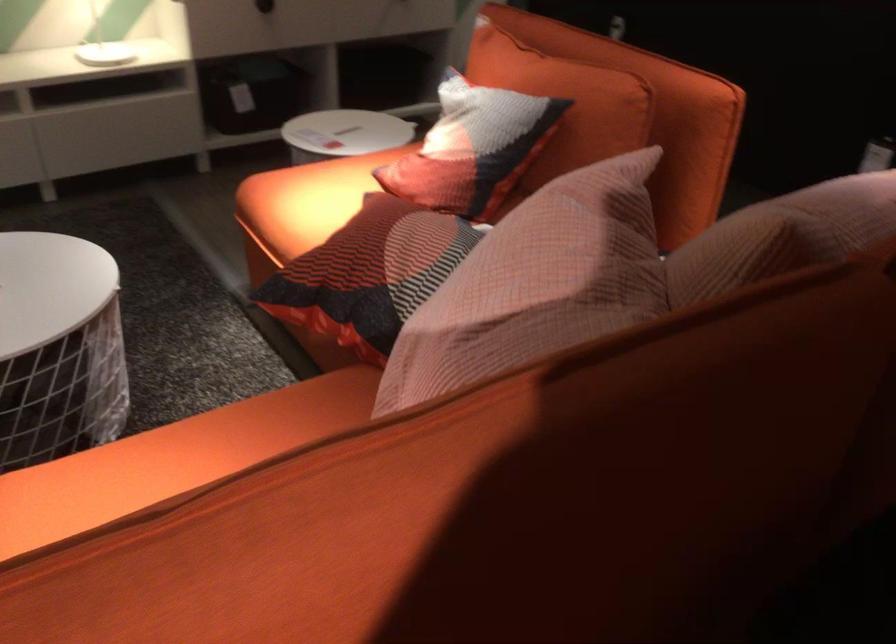
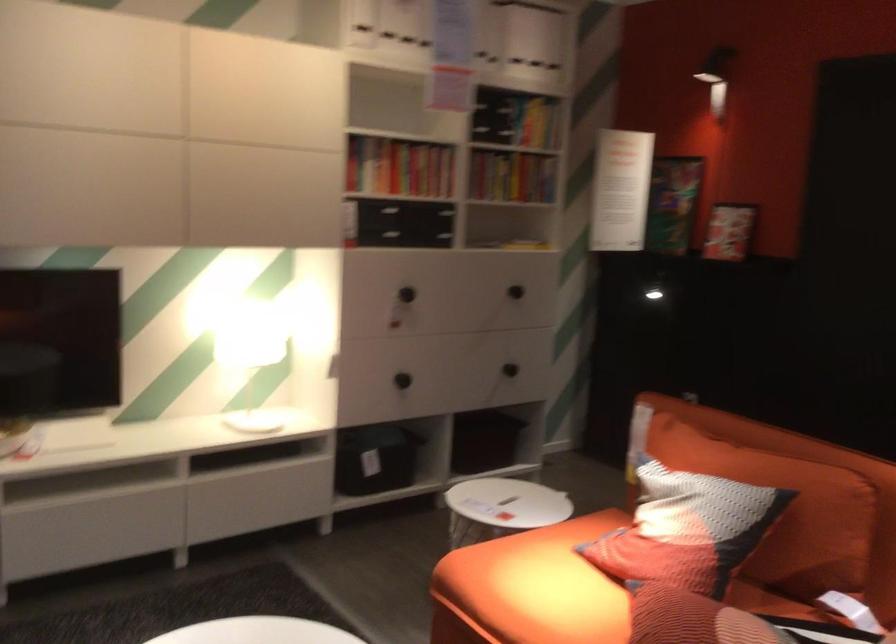
In the second image, find the point that corresponds to (x=455, y=147) in the first image.

(686, 529)